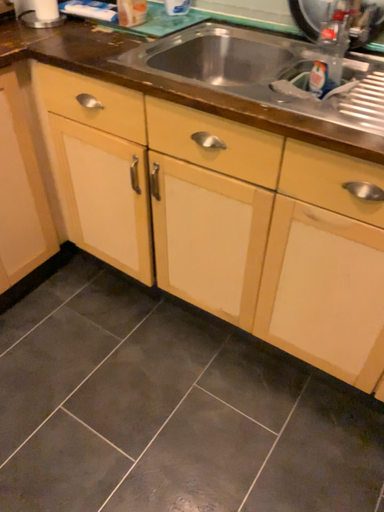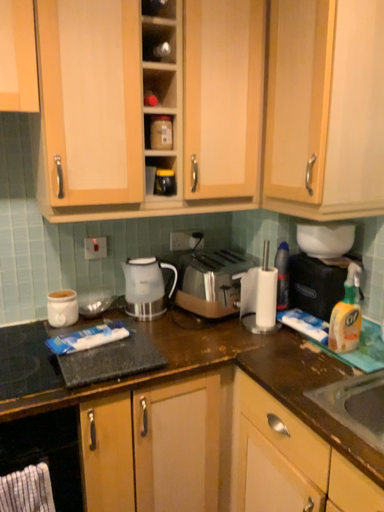
Question: Which way did the camera rotate in the video?

Choices:
 (A) rotated downward
 (B) rotated upward

Answer: (B)